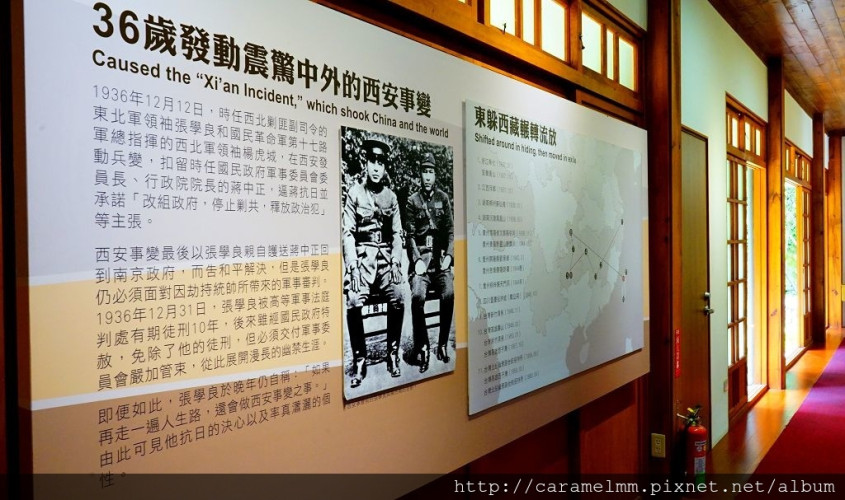
Where is `red floor`? The height and width of the screenshot is (500, 845). red floor is located at coordinates (813, 451).